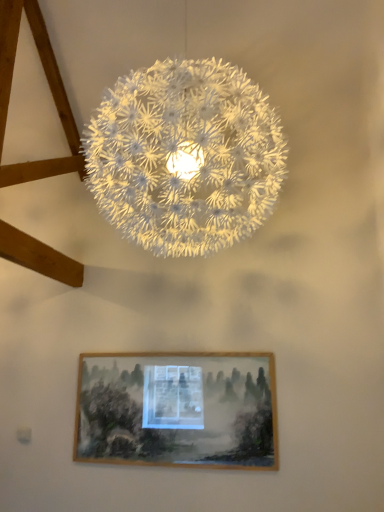
Question: In the image, is wooden picture frame at lower center positioned in front of or behind white textured sphere at center?

Choices:
 (A) front
 (B) behind

Answer: (B)

Question: Considering the positions of wooden picture frame at lower center and white textured sphere at center in the image, is wooden picture frame at lower center bigger or smaller than white textured sphere at center?

Choices:
 (A) big
 (B) small

Answer: (B)

Question: Which is correct: wooden picture frame at lower center is inside white textured sphere at center, or outside of it?

Choices:
 (A) inside
 (B) outside

Answer: (B)

Question: Is white textured sphere at center situated inside wooden picture frame at lower center or outside?

Choices:
 (A) outside
 (B) inside

Answer: (A)

Question: Considering the positions of white textured sphere at center and wooden picture frame at lower center in the image, is white textured sphere at center taller or shorter than wooden picture frame at lower center?

Choices:
 (A) short
 (B) tall

Answer: (B)

Question: From the image's perspective, is white textured sphere at center located above or below wooden picture frame at lower center?

Choices:
 (A) below
 (B) above

Answer: (B)

Question: Is point (215, 165) closer or farther from the camera than point (99, 423)?

Choices:
 (A) closer
 (B) farther

Answer: (A)